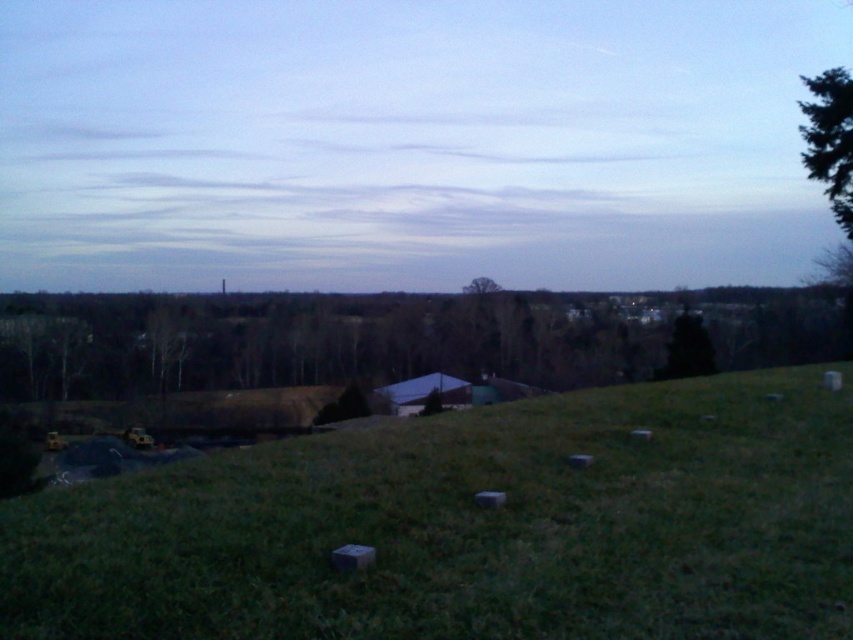
You are a landscape photographer planning to capture the entire scene in one shot. Given that the blue sky at upper center and the green grassy hill at lower center are both in your frame, which area should you focus on to ensure both are in focus, considering their sizes?

The blue sky at upper center is bigger than the green grassy hill at lower center, so you should focus on the blue sky at upper center to ensure both areas are in focus since it occupies more of the frame.

You are a painter wanting to capture the scene. You have a canvas that can only fit one of the two elements either the blue sky at upper center or the green textured tree at upper right. Based on their sizes, which one would you choose to ensure it fits entirely on your canvas?

The blue sky at upper center is wider than the green textured tree at upper right, so you should choose the blue sky at upper center to ensure it fits entirely on your canvas.